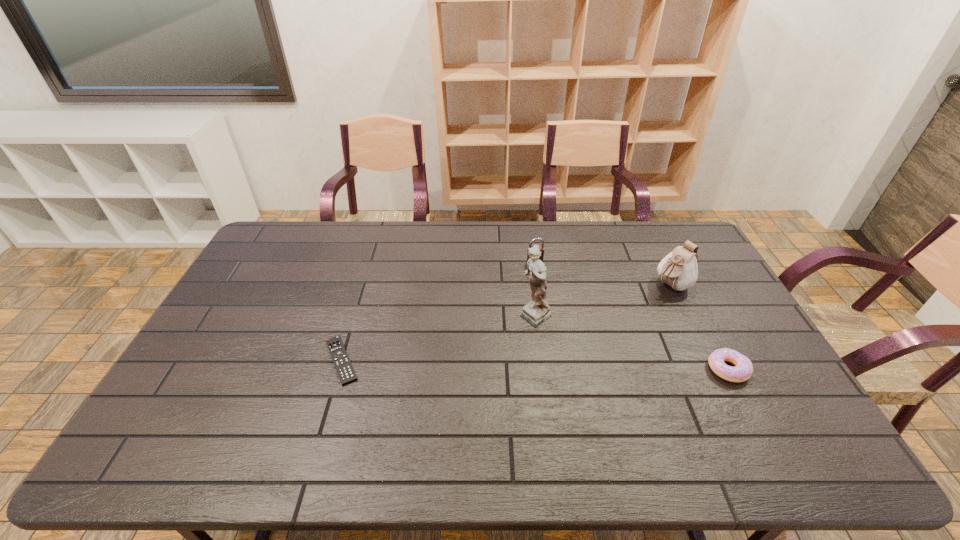
This screenshot has width=960, height=540. Identify the location of remote control. [x=346, y=373].

The height and width of the screenshot is (540, 960). Find the location of `the leftmost object`. the leftmost object is located at coordinates (346, 373).

The image size is (960, 540). What are the coordinates of `the fourth tallest object` in the screenshot? It's located at (743, 369).

You are a GUI agent. You are given a task and a screenshot of the screen. Output one action in this format:
    pyautogui.click(x=<x>, y=<y>)
    Task: Click on the padlock
    This screenshot has height=540, width=960.
    Given the screenshot: What is the action you would take?
    pyautogui.click(x=541, y=248)

Find the location of a particular element. This screenshot has width=960, height=540. the farthest object is located at coordinates (541, 248).

Locate an element on the screen. the third nearest object is located at coordinates coord(537,311).

You are a GUI agent. You are given a task and a screenshot of the screen. Output one action in this format:
    pyautogui.click(x=<x>, y=<y>)
    Task: Click on the figurine
    The height and width of the screenshot is (540, 960).
    Given the screenshot: What is the action you would take?
    pyautogui.click(x=537, y=311)

At what (x,y) coordinates should I click in order to perform the action: click on pouch. Please return your answer as a coordinate pair (x, y). This screenshot has width=960, height=540. Looking at the image, I should click on (679, 269).

Find the location of `the fourth shortest object`. the fourth shortest object is located at coordinates (679, 269).

Find the location of a particular element. Image resolution: width=960 pixels, height=540 pixels. vacant point located on the back of the shortest object is located at coordinates (352, 322).